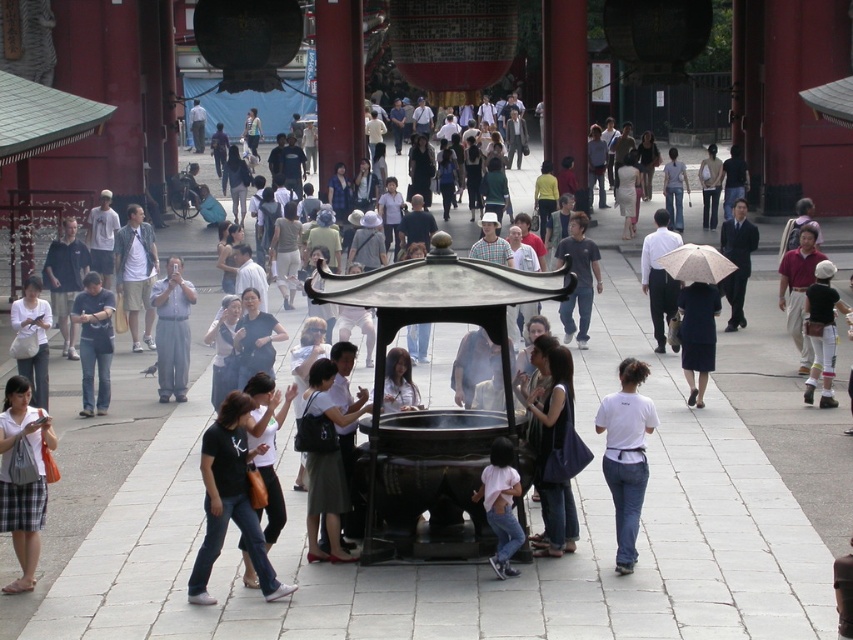
Question: Does denim skirt at center have a larger size compared to pink fabric shirt at center?

Choices:
 (A) no
 (B) yes

Answer: (B)

Question: Which point appears closest to the camera in this image?

Choices:
 (A) click(x=38, y=483)
 (B) click(x=326, y=364)
 (C) click(x=225, y=506)
 (D) click(x=26, y=296)

Answer: (C)

Question: Does white matte shirt at center have a greater width compared to pink fabric shirt at center?

Choices:
 (A) no
 (B) yes

Answer: (B)

Question: Among these points, which one is farthest from the camera?

Choices:
 (A) (47, 305)
 (B) (498, 456)
 (C) (86, 417)

Answer: (C)

Question: Among these points, which one is nearest to the camera?

Choices:
 (A) (18, 412)
 (B) (485, 488)
 (C) (83, 289)

Answer: (A)

Question: Is white fabric shirt at lower left above pink fabric shirt at center?

Choices:
 (A) yes
 (B) no

Answer: (A)